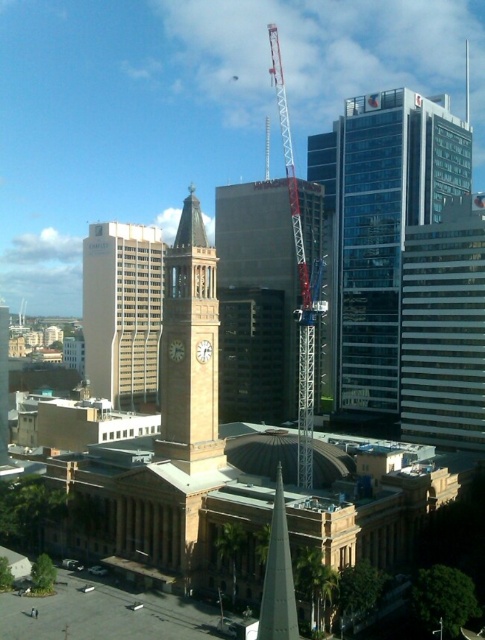
Can you confirm if beige stone clock tower at center is positioned above beige concrete clock tower at center-left?

No, beige stone clock tower at center is not above beige concrete clock tower at center-left.

Locate an element on the screen. This screenshot has height=640, width=485. beige stone clock tower at center is located at coordinates (190, 348).

Does glassy blue skyscraper at upper right appear on the right side of clear glass skyscraper at right?

In fact, glassy blue skyscraper at upper right is to the left of clear glass skyscraper at right.

Is point (439, 144) closer to viewer compared to point (481, 397)?

That is False.

Locate an element on the screen. glassy blue skyscraper at upper right is located at coordinates (378, 228).

Who is more forward, (453, 394) or (308, 390)?

Point (308, 390)

Is clear glass skyscraper at right closer to camera compared to metallic red crane at center?

No.

Is point (471, 372) less distant than point (272, 26)?

Yes, it is in front of point (272, 26).

Where is `clear glass skyscraper at right`? Image resolution: width=485 pixels, height=640 pixels. clear glass skyscraper at right is located at coordinates (443, 328).